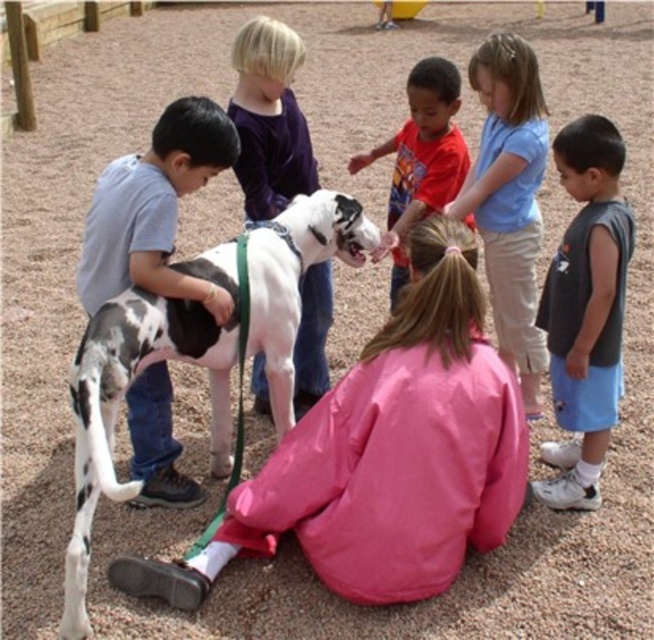
Can you confirm if spotted fur dog at center is positioned below smooth purple shirt at upper center?

Indeed, spotted fur dog at center is positioned under smooth purple shirt at upper center.

Can you confirm if spotted fur dog at center is positioned to the right of smooth purple shirt at upper center?

In fact, spotted fur dog at center is to the left of smooth purple shirt at upper center.

This screenshot has width=654, height=640. Identify the location of spotted fur dog at center. (x=118, y=403).

Image resolution: width=654 pixels, height=640 pixels. Find the location of `spotted fur dog at center`. spotted fur dog at center is located at coordinates (118, 403).

Who is positioned more to the right, light blue cotton shirt at upper center or red cotton shirt at center?

Positioned to the right is light blue cotton shirt at upper center.

Consider the image. Measure the distance from light blue cotton shirt at upper center to red cotton shirt at center.

light blue cotton shirt at upper center is 13.04 inches away from red cotton shirt at center.

Who is more forward, (528, 141) or (388, 243)?

Point (528, 141) is more forward.

The image size is (654, 640). I want to click on light blue cotton shirt at upper center, so click(x=509, y=198).

Is spotted fur dalmatian at left above smooth purple shirt at upper center?

Incorrect, spotted fur dalmatian at left is not positioned above smooth purple shirt at upper center.

Is point (173, 100) behind point (324, 298)?

No, (173, 100) is closer to viewer.

Is point (162, 419) positioned before point (301, 179)?

Yes.

At what (x,y) coordinates should I click in order to perform the action: click on spotted fur dalmatian at left. Please return your answer as a coordinate pair (x, y). Looking at the image, I should click on (154, 209).